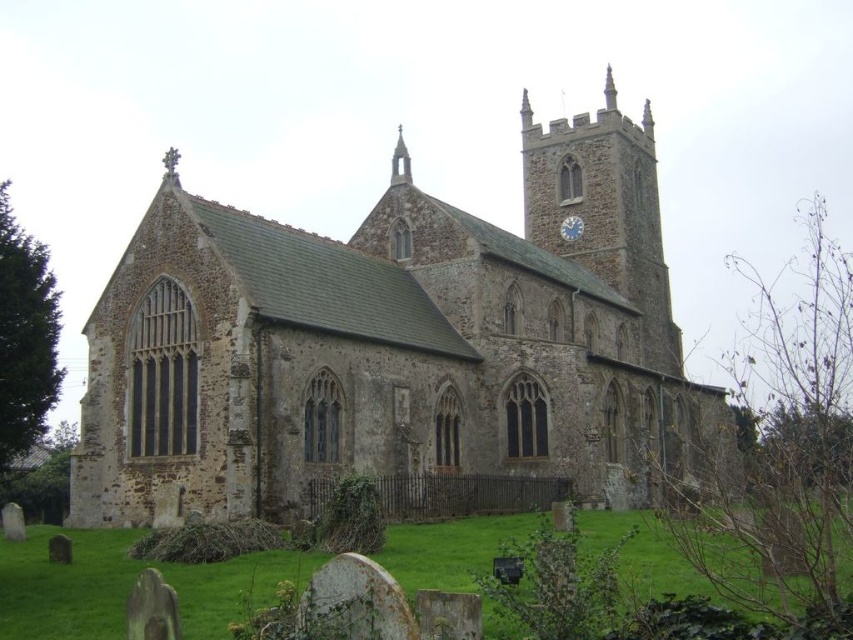
Can you confirm if brown stone church at center is positioned below stone clock tower at upper right?

Yes, brown stone church at center is below stone clock tower at upper right.

Can you confirm if brown stone church at center is positioned to the left of stone clock tower at upper right?

Correct, you'll find brown stone church at center to the left of stone clock tower at upper right.

Between point (112, 356) and point (566, 156), which one is positioned behind?

The point (566, 156) is more distant.

The image size is (853, 640). Find the location of `brown stone church at center`. brown stone church at center is located at coordinates (393, 342).

Does stone clock tower at upper right have a smaller size compared to white metallic clock at upper right?

No.

Can you confirm if stone clock tower at upper right is taller than white metallic clock at upper right?

Yes.

The height and width of the screenshot is (640, 853). I want to click on stone clock tower at upper right, so click(604, 211).

Who is higher up, brown stone church at center or white metallic clock at upper right?

white metallic clock at upper right is above.

Is point (192, 400) more distant than point (569, 225)?

No, (192, 400) is closer to viewer.

In order to click on brown stone church at center in this screenshot , I will do `click(393, 342)`.